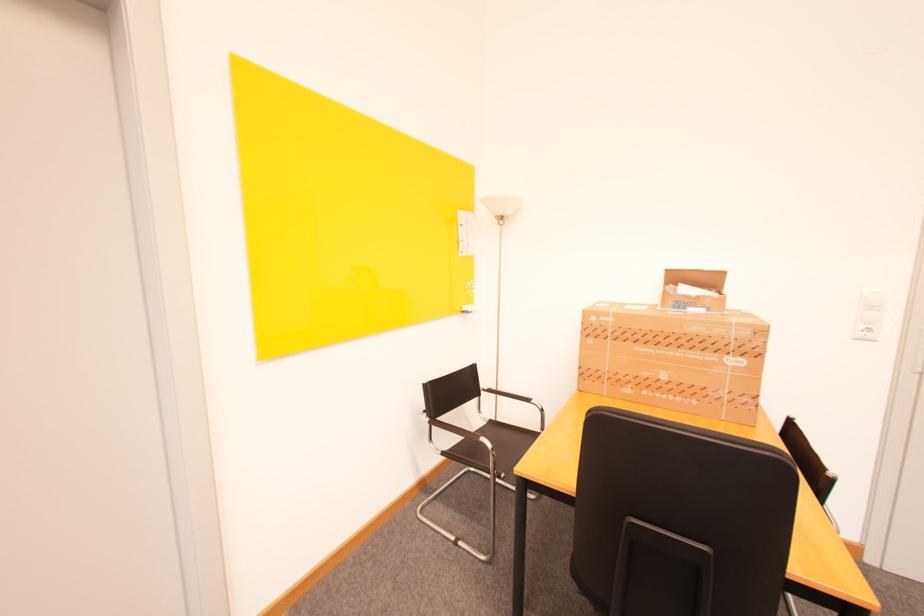
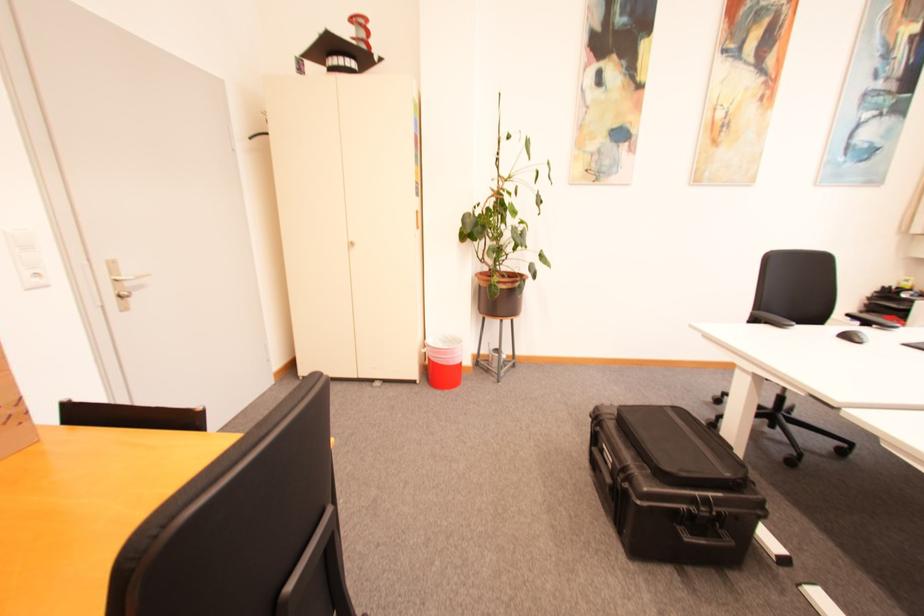
Where in the second image is the point corresponding to (873,334) from the first image?

(43, 281)